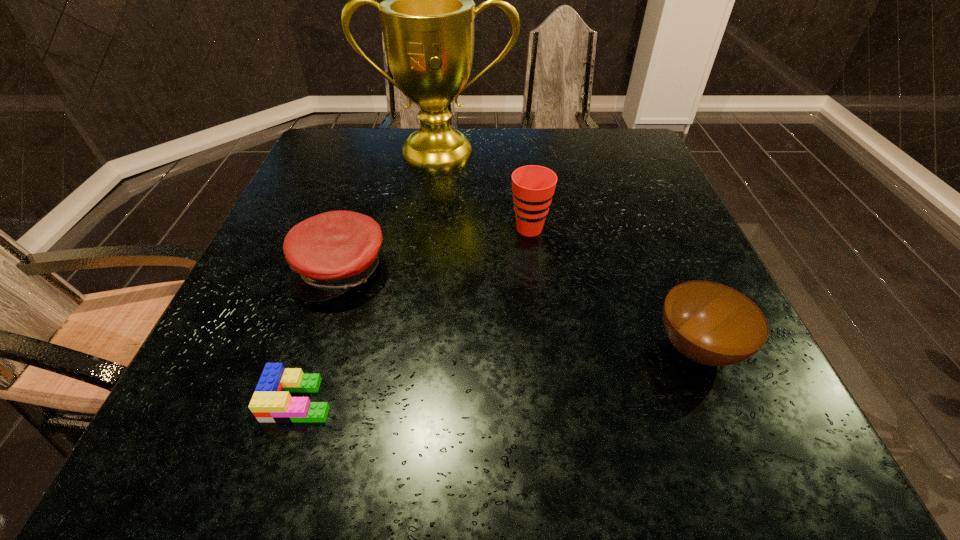
You are a GUI agent. You are given a task and a screenshot of the screen. Output one action in this format:
    pyautogui.click(x=<x>, y=<y>)
    Task: Click on the tallest object
    The width and height of the screenshot is (960, 540).
    Given the screenshot: What is the action you would take?
    pyautogui.click(x=427, y=16)

The image size is (960, 540). What are the coordinates of `the farthest object` in the screenshot? It's located at (427, 16).

Find the location of `the second tallest object`. the second tallest object is located at coordinates (533, 186).

In order to click on cap in this screenshot , I will do `click(330, 253)`.

Locate an element on the screen. This screenshot has height=540, width=960. the rightmost object is located at coordinates (709, 323).

This screenshot has height=540, width=960. I want to click on Lego, so click(271, 402).

Identify the location of free location located on the shiny surface of the farthest object. Image resolution: width=960 pixels, height=540 pixels. (427, 250).

I want to click on free space located on the back of the fourth shortest object, so click(519, 151).

Identify the location of vacant space located on the front-facing side of the cap. (309, 372).

Image resolution: width=960 pixels, height=540 pixels. What are the coordinates of `blank space located on the left of the bowl` in the screenshot? It's located at (524, 348).